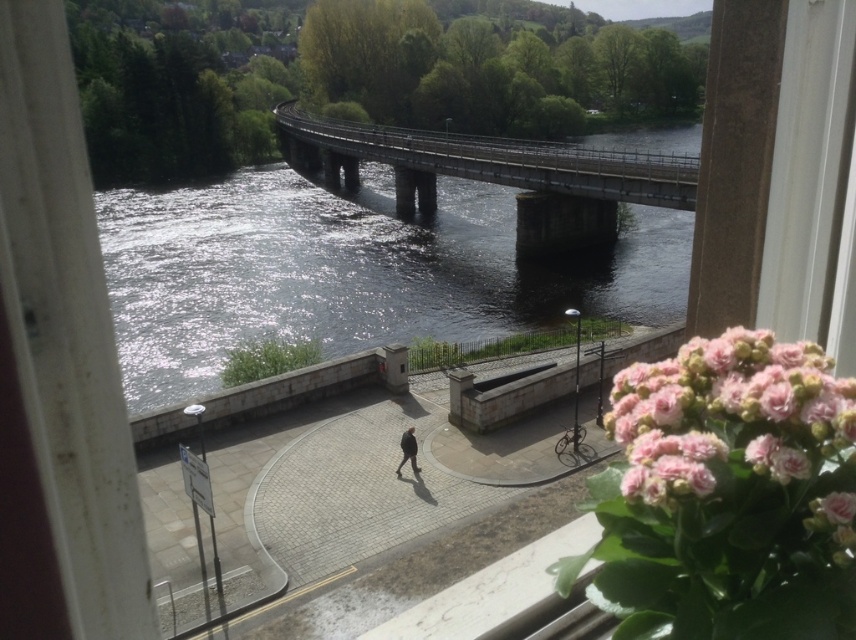
Can you confirm if dark gray concrete river at center is taller than concrete bridge at center?

No, dark gray concrete river at center is not taller than concrete bridge at center.

Is point (657, 304) closer to viewer compared to point (643, 186)?

No, it is behind (643, 186).

Between point (192, 275) and point (489, 148), which one is positioned behind?

The point (489, 148) is more distant.

Find the location of a particular element. This screenshot has height=640, width=856. dark gray concrete river at center is located at coordinates (349, 272).

Does dark gray concrete river at center have a larger size compared to pink fluffy flowers at lower right?

Indeed, dark gray concrete river at center has a larger size compared to pink fluffy flowers at lower right.

Which is in front, point (500, 236) or point (654, 412)?

Point (654, 412) is more forward.

I want to click on dark gray concrete river at center, so click(349, 272).

Can you confirm if pink fluffy flowers at lower right is smaller than concrete bridge at center?

Correct, pink fluffy flowers at lower right occupies less space than concrete bridge at center.

Does pink fluffy flowers at lower right have a greater width compared to concrete bridge at center?

Incorrect, pink fluffy flowers at lower right's width does not surpass concrete bridge at center's.

You are a GUI agent. You are given a task and a screenshot of the screen. Output one action in this format:
    pyautogui.click(x=<x>, y=<y>)
    Task: Click on the pink fluffy flowers at lower right
    
    Given the screenshot: What is the action you would take?
    pyautogui.click(x=736, y=436)